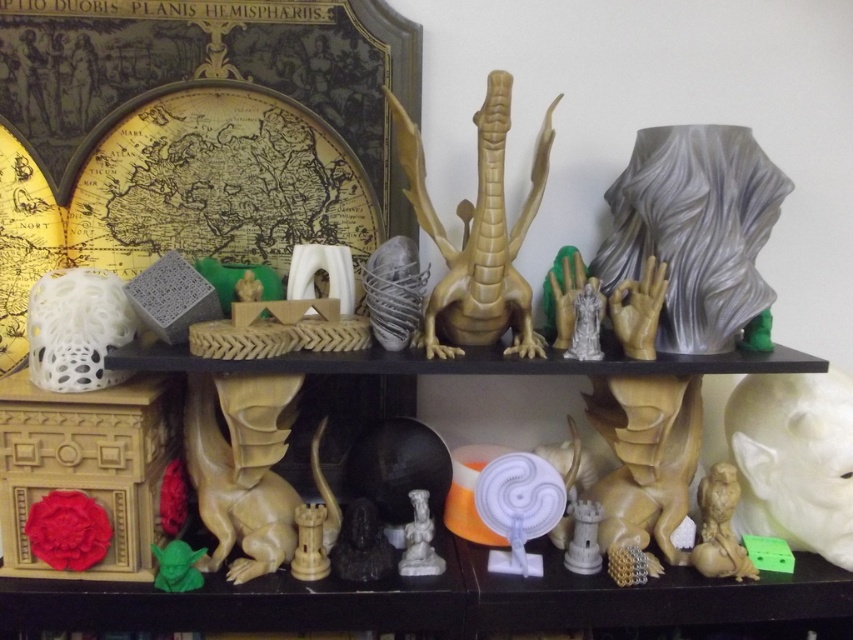
Question: Does matte brown owl at lower right appear on the left side of green matte yoda head at lower left?

Choices:
 (A) yes
 (B) no

Answer: (B)

Question: Which point is farther from the camera taking this photo?

Choices:
 (A) (503, 236)
 (B) (756, 572)
 (C) (595, 532)

Answer: (B)

Question: Estimate the real-world distances between objects in this image. Which object is closer to the green matte yoda head at lower left?

Choices:
 (A) matte gold dragon at center
 (B) matte brown owl at lower right

Answer: (A)

Question: Does matte gold dragon at center have a smaller size compared to matte white tower at center?

Choices:
 (A) yes
 (B) no

Answer: (B)

Question: Based on their relative distances, which object is farther from the white glossy statue at center?

Choices:
 (A) matte gold dragon at center
 (B) matte brown owl at lower right
 (C) green matte yoda head at lower left
 (D) white matte bird at lower right

Answer: (D)

Question: Does matte gold dragon at center have a lesser width compared to matte white tower at center?

Choices:
 (A) yes
 (B) no

Answer: (B)